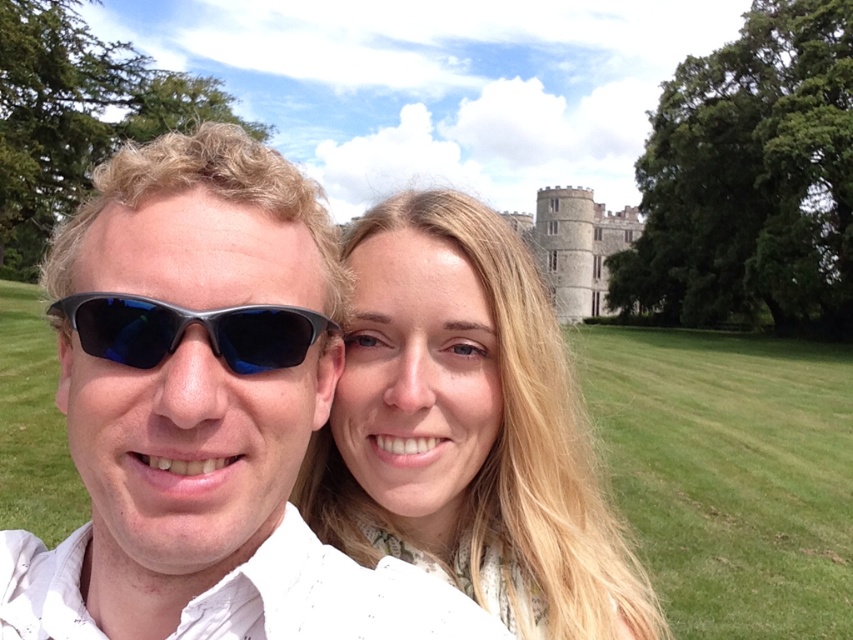
Is point (538, 364) positioned in front of point (577, 211)?

That is True.

Is point (403, 545) closer to viewer compared to point (518, 234)?

That is True.

Locate an element on the screen. This screenshot has width=853, height=640. blonde hair at center is located at coordinates (468, 429).

Which is more to the right, blonde hair at center or sunglasses at left?

blonde hair at center

Does blonde hair at center have a greater width compared to sunglasses at left?

Yes, blonde hair at center is wider than sunglasses at left.

Describe the element at coordinates (468, 429) in the screenshot. I see `blonde hair at center` at that location.

Where is `blonde hair at center`? This screenshot has width=853, height=640. blonde hair at center is located at coordinates (468, 429).

Between point (281, 435) and point (494, 595), which one is positioned in front?

Point (281, 435)

Can you confirm if matte white sunglasses at center is wider than blonde hair at center?

Yes, matte white sunglasses at center is wider than blonde hair at center.

In order to click on matte white sunglasses at center in this screenshot , I will do `click(202, 413)`.